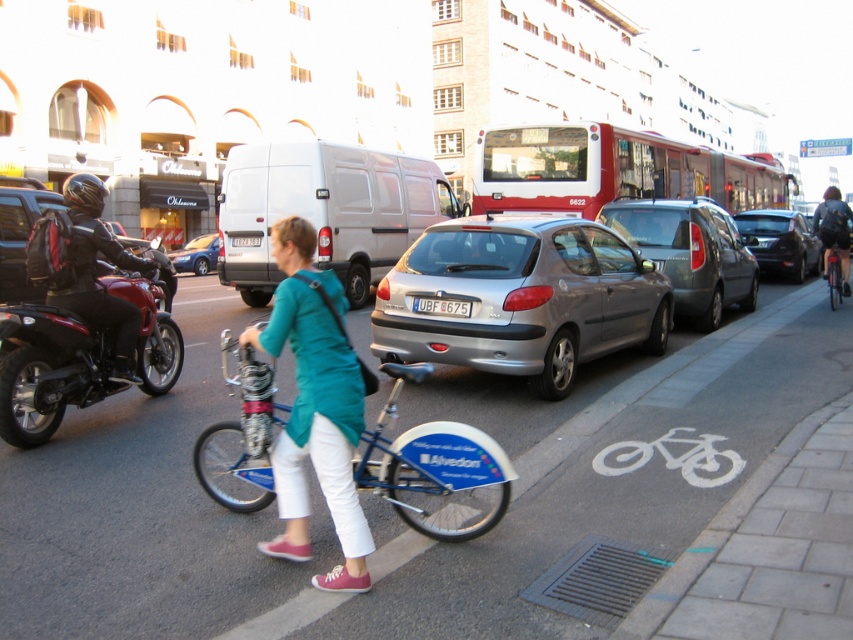
Between blue metallic bike at center and satin silver car at center, which one has more height?

With more height is satin silver car at center.

Locate an element on the screen. blue metallic bike at center is located at coordinates (383, 500).

Who is more forward, (345, 513) or (508, 180)?

Point (345, 513)

Is teal fabric shirt at center thinner than red matte bus at upper right?

Correct, teal fabric shirt at center's width is less than red matte bus at upper right's.

Find the location of `teal fabric shirt at center`. teal fabric shirt at center is located at coordinates click(315, 406).

At what (x,y) coordinates should I click in order to perform the action: click on teal fabric shirt at center. Please return your answer as a coordinate pair (x, y). The height and width of the screenshot is (640, 853). Looking at the image, I should click on (315, 406).

Is silver metallic hatchback at center bigger than white plastic license plate at center?

Yes, silver metallic hatchback at center is bigger than white plastic license plate at center.

Does silver metallic hatchback at center appear on the left side of white plastic license plate at center?

In fact, silver metallic hatchback at center is to the right of white plastic license plate at center.

Between point (552, 259) and point (247, 241), which one is positioned in front?

Point (552, 259)

Identify the location of silver metallic hatchback at center. This screenshot has width=853, height=640. (521, 298).